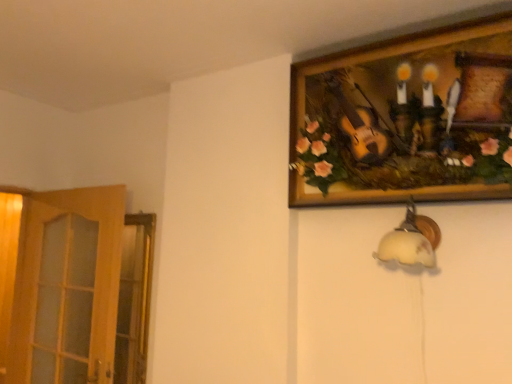
This screenshot has width=512, height=384. What do you see at coordinates (67, 287) in the screenshot? I see `wooden at left` at bounding box center [67, 287].

The width and height of the screenshot is (512, 384). Describe the element at coordinates (411, 240) in the screenshot. I see `white frosted glass lampshade at lower right` at that location.

This screenshot has height=384, width=512. I want to click on wooden picture frame at upper right, so click(404, 118).

Could wooden at left be considered to be inside wooden picture frame at upper right?

No, wooden at left is not a part of wooden picture frame at upper right.

In the scene shown: How far apart are wooden picture frame at upper right and wooden at left?

The distance of wooden picture frame at upper right from wooden at left is 4.48 feet.

Where is `door behind the wooden picture frame at upper right`? door behind the wooden picture frame at upper right is located at coordinates (67, 287).

Can you confirm if white frosted glass lampshade at lower right is wider than wooden at left?

Yes.

Does white frosted glass lampshade at lower right have a larger size compared to wooden at left?

Actually, white frosted glass lampshade at lower right might be smaller than wooden at left.

From a real-world perspective, relative to wooden at left, is white frosted glass lampshade at lower right vertically above or below?

white frosted glass lampshade at lower right is situated higher than wooden at left in the real world.

Is the surface of white frosted glass lampshade at lower right in direct contact with wooden at left?

They are not placed beside each other.

How different are the orientations of wooden picture frame at upper right and white frosted glass lampshade at lower right in degrees?

0.000388 degrees.

From the picture: Does wooden picture frame at upper right come behind white frosted glass lampshade at lower right?

No, it is in front of white frosted glass lampshade at lower right.

Considering the relative sizes of wooden picture frame at upper right and white frosted glass lampshade at lower right in the image provided, is wooden picture frame at upper right shorter than white frosted glass lampshade at lower right?

No, wooden picture frame at upper right is not shorter than white frosted glass lampshade at lower right.

Is wooden picture frame at upper right thinner than white frosted glass lampshade at lower right?

Correct, the width of wooden picture frame at upper right is less than that of white frosted glass lampshade at lower right.

From their relative heights in the image, would you say white frosted glass lampshade at lower right is taller or shorter than wooden picture frame at upper right?

In the image, white frosted glass lampshade at lower right appears to be shorter than wooden picture frame at upper right.

In the scene shown: Considering the sizes of objects white frosted glass lampshade at lower right and wooden picture frame at upper right in the image provided, who is thinner, white frosted glass lampshade at lower right or wooden picture frame at upper right?

With smaller width is wooden picture frame at upper right.

Are white frosted glass lampshade at lower right and wooden picture frame at upper right making contact?

No, white frosted glass lampshade at lower right is not touching wooden picture frame at upper right.

Are wooden at left and white frosted glass lampshade at lower right beside each other?

No, wooden at left is not with white frosted glass lampshade at lower right.

Is wooden at left inside the boundaries of white frosted glass lampshade at lower right, or outside?

wooden at left lies outside white frosted glass lampshade at lower right.

Considering the relative sizes of wooden at left and white frosted glass lampshade at lower right in the image provided, is wooden at left taller than white frosted glass lampshade at lower right?

Yes.

Between wooden at left and white frosted glass lampshade at lower right, which one appears on the left side from the viewer's perspective?

Positioned to the left is wooden at left.

From a real-world perspective, is wooden at left over wooden picture frame at upper right?

No, from a real-world perspective, wooden at left is not on top of wooden picture frame at upper right.

Considering the positions of objects wooden at left and wooden picture frame at upper right in the image provided, who is more to the right, wooden at left or wooden picture frame at upper right?

Positioned to the right is wooden picture frame at upper right.

Can you confirm if wooden at left is bigger than wooden picture frame at upper right?

Yes.

What are the coordinates of `picture frame in front of the wooden at left` in the screenshot? It's located at (404, 118).

The width and height of the screenshot is (512, 384). Identify the location of lamp lying on the right of wooden at left. (411, 240).

Estimate the real-world distances between objects in this image. Which object is further from wooden at left, wooden picture frame at upper right or white frosted glass lampshade at lower right?

Based on the image, white frosted glass lampshade at lower right appears to be further to wooden at left.

Based on their spatial positions, is wooden at left or white frosted glass lampshade at lower right closer to wooden picture frame at upper right?

Based on the image, white frosted glass lampshade at lower right appears to be nearer to wooden picture frame at upper right.

Based on their spatial positions, is wooden picture frame at upper right or wooden at left closer to white frosted glass lampshade at lower right?

wooden picture frame at upper right is positioned closer to the anchor white frosted glass lampshade at lower right.

Looking at the image, which one is located closer to wooden at left, white frosted glass lampshade at lower right or wooden picture frame at upper right?

The object closer to wooden at left is wooden picture frame at upper right.

Looking at the image, which one is located further to wooden picture frame at upper right, white frosted glass lampshade at lower right or wooden at left?

wooden at left is positioned further to the anchor wooden picture frame at upper right.

When comparing their distances from white frosted glass lampshade at lower right, does wooden at left or wooden picture frame at upper right seem further?

The object further to white frosted glass lampshade at lower right is wooden at left.

The height and width of the screenshot is (384, 512). In order to click on picture frame situated between wooden at left and white frosted glass lampshade at lower right from left to right in this screenshot , I will do `click(404, 118)`.